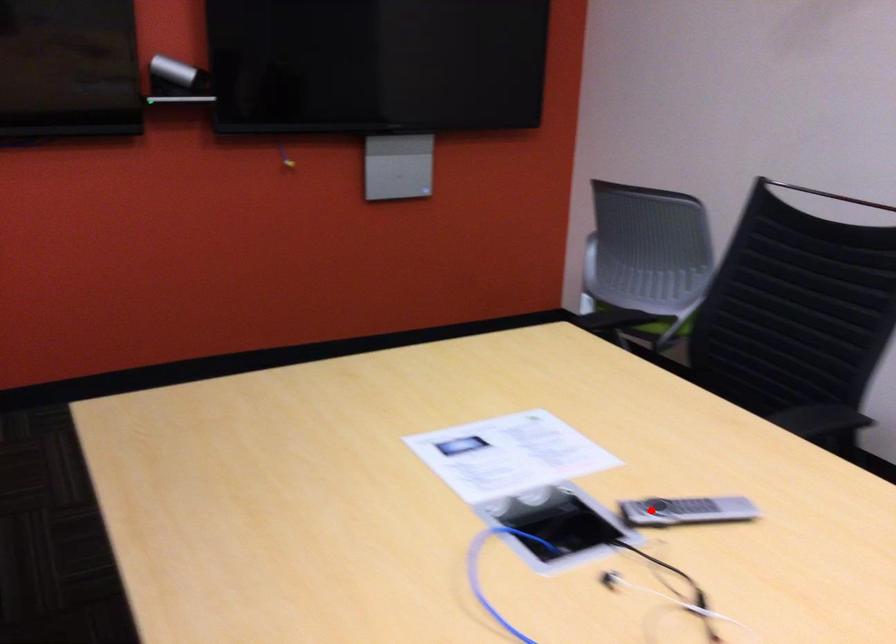
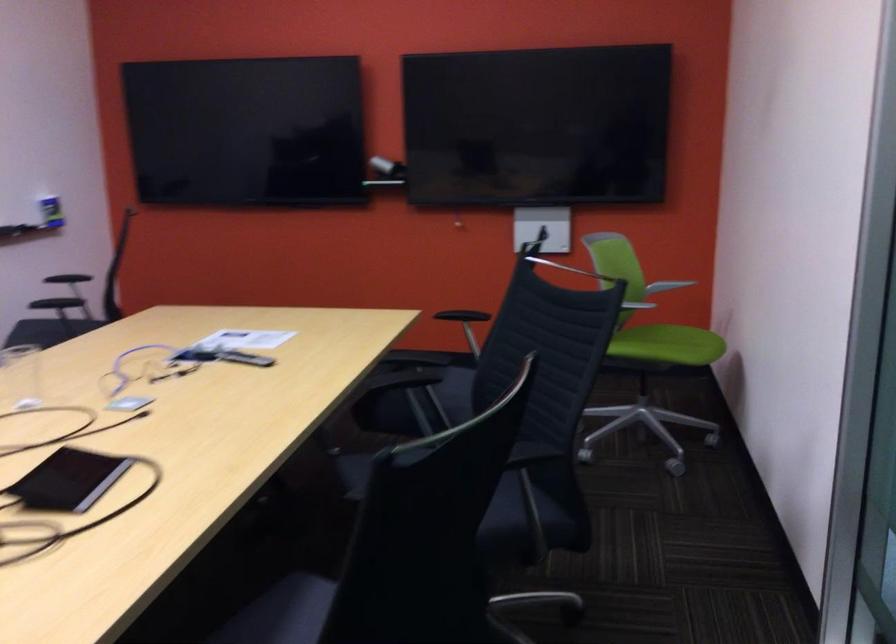
In the second image, find the point that corresponds to the highlighted location in the first image.

(244, 357)